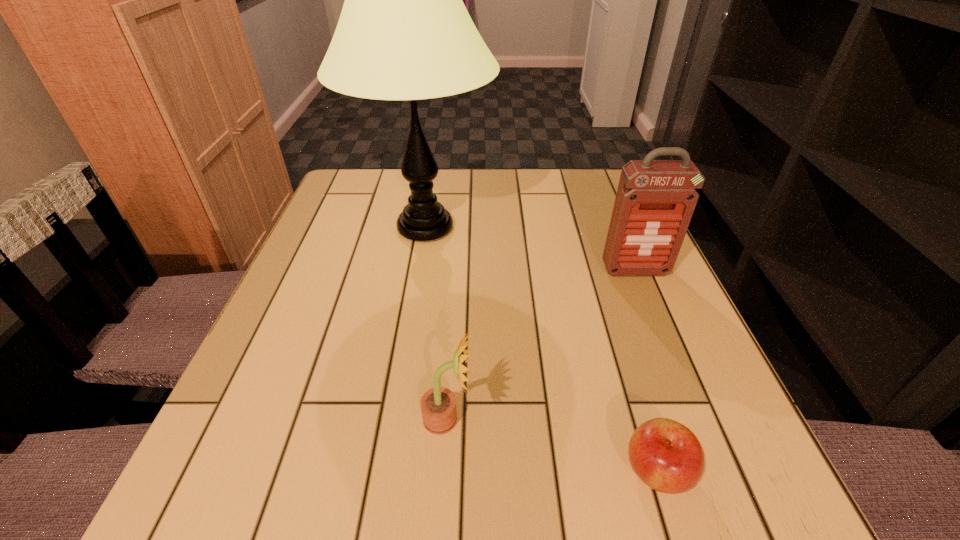
Where is `object that stands as the third closest to the tallest object`? This screenshot has width=960, height=540. object that stands as the third closest to the tallest object is located at coordinates (667, 456).

Where is `object that is the closest to the second shortest object`? This screenshot has width=960, height=540. object that is the closest to the second shortest object is located at coordinates (667, 456).

At what (x,y) coordinates should I click in order to perform the action: click on free space that satisfies the following two spatial constraints: 1. on the front-facing side of the second tallest object; 2. on the face of the sunflower. Please return your answer as a coordinate pair (x, y). The height and width of the screenshot is (540, 960). Looking at the image, I should click on (696, 420).

Identify the location of free location that satisfies the following two spatial constraints: 1. on the front-facing side of the third shortest object; 2. on the face of the third tallest object. This screenshot has width=960, height=540. (696, 420).

Locate an element on the screen. Image resolution: width=960 pixels, height=540 pixels. blank area in the image that satisfies the following two spatial constraints: 1. on the front-facing side of the first-aid kit; 2. on the face of the second shortest object is located at coordinates (696, 420).

The width and height of the screenshot is (960, 540). I want to click on vacant point that satisfies the following two spatial constraints: 1. on the front-facing side of the second tallest object; 2. on the face of the second shortest object, so click(x=696, y=420).

Find the location of `free space that satisfies the following two spatial constraints: 1. on the face of the apple; 2. on the left side of the third tallest object`. free space that satisfies the following two spatial constraints: 1. on the face of the apple; 2. on the left side of the third tallest object is located at coordinates (444, 471).

Identify the location of vacant area in the image that satisfies the following two spatial constraints: 1. on the front-facing side of the second tallest object; 2. on the face of the third tallest object. (696, 420).

The width and height of the screenshot is (960, 540). In order to click on free location that satisfies the following two spatial constraints: 1. on the front side of the tallest object; 2. on the right side of the apple in this screenshot , I will do `click(386, 471)`.